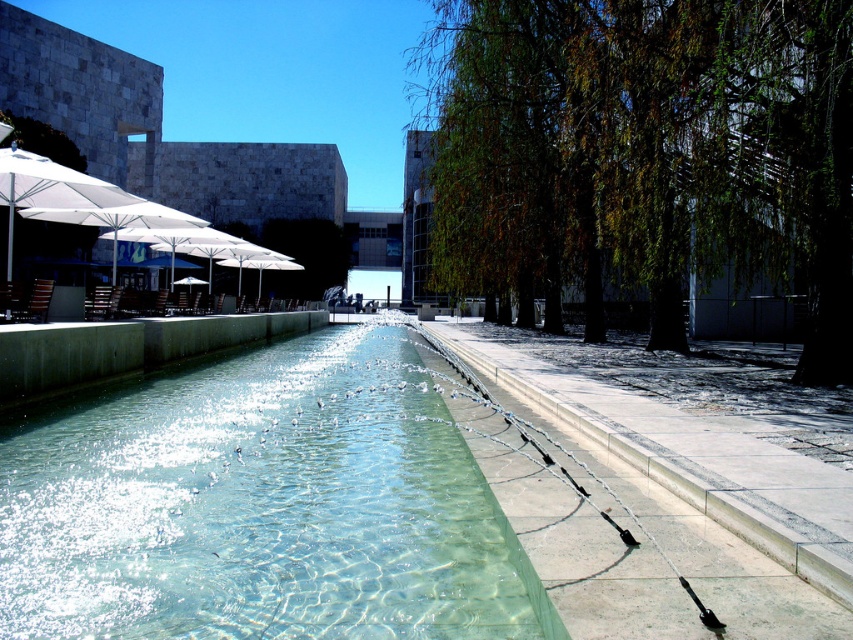
Question: Does clear glass pool at center have a lesser width compared to white fabric umbrella at left?

Choices:
 (A) yes
 (B) no

Answer: (A)

Question: Where is clear glass pool at center located in relation to white fabric umbrella at left in the image?

Choices:
 (A) right
 (B) left

Answer: (A)

Question: From the image, what is the correct spatial relationship of clear glass pool at center in relation to white fabric umbrella at left?

Choices:
 (A) above
 (B) below

Answer: (B)

Question: Which point appears closest to the camera in this image?

Choices:
 (A) (82, 220)
 (B) (521, 604)

Answer: (B)